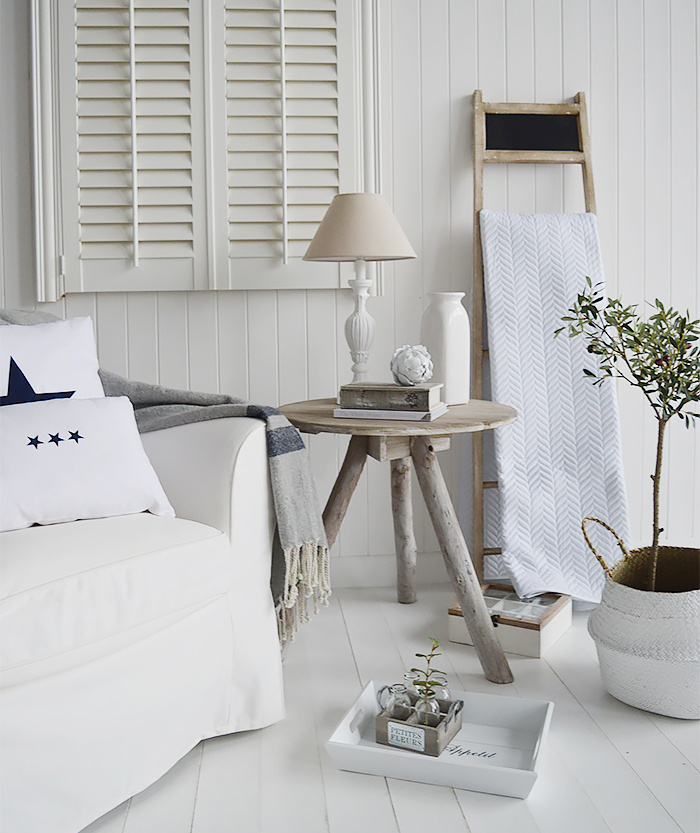
You are a GUI agent. You are given a task and a screenshot of the screen. Output one action in this format:
    pyautogui.click(x=<x>, y=<y>)
    Task: Click on the towel holder
    
    Given the screenshot: What is the action you would take?
    pyautogui.click(x=518, y=151)